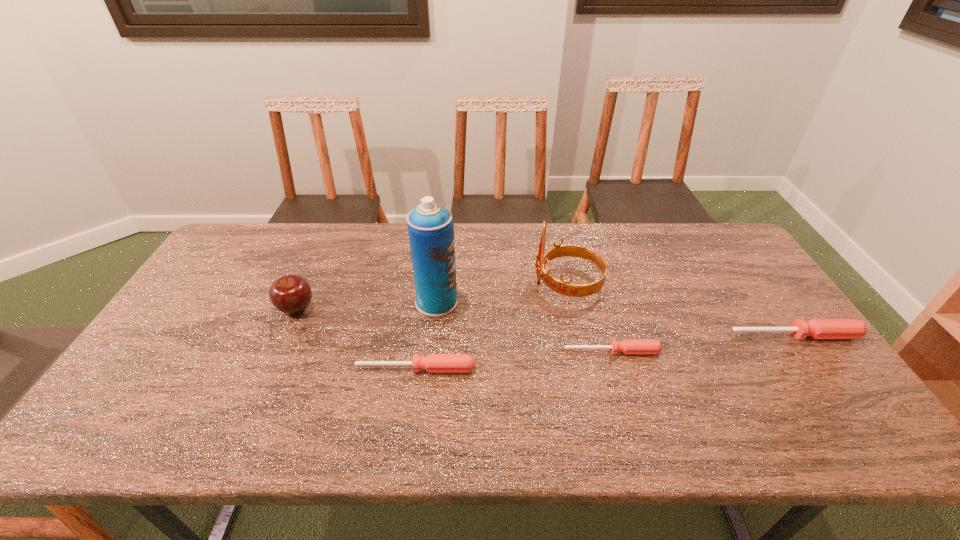
You are a GUI agent. You are given a task and a screenshot of the screen. Output one action in this format:
    pyautogui.click(x=<x>, y=<y>)
    Task: Click on the vacant area at the far edge of the desktop
    The image size is (960, 540).
    Given the screenshot: What is the action you would take?
    pyautogui.click(x=390, y=235)

Find the location of `vacant region at the near edge`. vacant region at the near edge is located at coordinates (503, 397).

Where is `vacant region at the left edge of the desktop`? vacant region at the left edge of the desktop is located at coordinates tap(184, 317).

Locate an element on the screen. The height and width of the screenshot is (540, 960). vacant region at the right edge of the desktop is located at coordinates (771, 318).

The width and height of the screenshot is (960, 540). Identify the location of vacant space at the far right corner. (708, 238).

Where is `free region at the near right corner of the desktop`? The height and width of the screenshot is (540, 960). free region at the near right corner of the desktop is located at coordinates (779, 399).

Where is `vacant region between the nearest screwdriver and the apple`? The image size is (960, 540). vacant region between the nearest screwdriver and the apple is located at coordinates (356, 338).

In order to click on empty space that is in between the apple and the leftmost screwdriver in this screenshot , I will do `click(356, 338)`.

Identify the location of free area in between the farthest screwdriver and the leftmost object. Image resolution: width=960 pixels, height=540 pixels. (545, 322).

Identify the location of blank region between the tallest object and the second screwdriver from left to right. This screenshot has width=960, height=540. (524, 326).